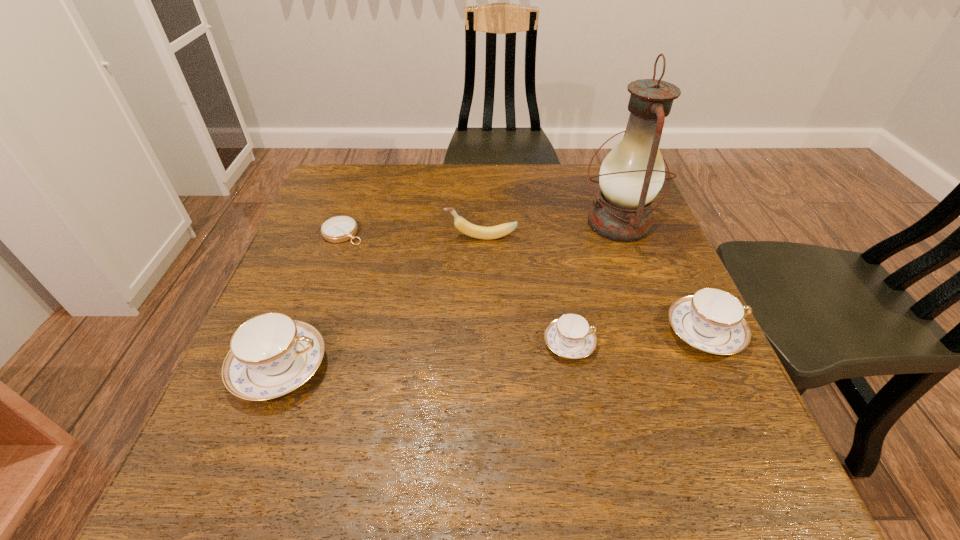
To achieve even spacing by inserting another teacup among them, please point to a vacant spot for this new teacup. Please provide its 2D coordinates. Your answer should be formatted as a tuple, i.e. [(x, y)], where the tuple contains the x and y coordinates of a point satisfying the conditions above.

[(428, 355)]